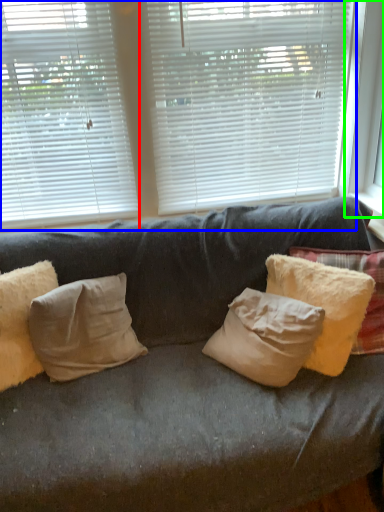
Question: Which is farther away from window blind (highlighted by a red box)? window blind (highlighted by a blue box) or window frame (highlighted by a green box)?

Choices:
 (A) window blind
 (B) window frame

Answer: (B)